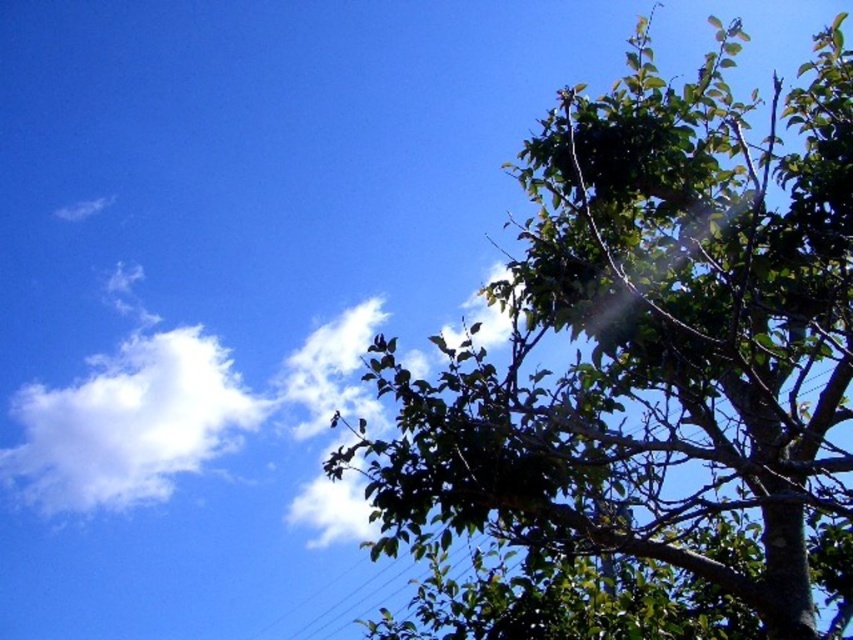
Is green leafy tree at upper right shorter than white fluffy cloud at upper left?

Incorrect, green leafy tree at upper right's height does not fall short of white fluffy cloud at upper left's.

The height and width of the screenshot is (640, 853). Identify the location of green leafy tree at upper right. (646, 378).

Does point (685, 332) come farther from viewer compared to point (361, 586)?

No, it is in front of (361, 586).

Is green leafy tree at upper right to the right of black wire at upper center from the viewer's perspective?

Yes, green leafy tree at upper right is to the right of black wire at upper center.

Image resolution: width=853 pixels, height=640 pixels. I want to click on green leafy tree at upper right, so click(x=646, y=378).

The width and height of the screenshot is (853, 640). Find the location of `green leafy tree at upper right`. green leafy tree at upper right is located at coordinates (646, 378).

Does white fluffy cloud at upper left appear on the left side of black wire at upper center?

Yes, white fluffy cloud at upper left is to the left of black wire at upper center.

Between white fluffy cloud at upper left and black wire at upper center, which one has less height?

With less height is black wire at upper center.

Describe the element at coordinates (128, 422) in the screenshot. I see `white fluffy cloud at upper left` at that location.

This screenshot has width=853, height=640. What are the coordinates of `white fluffy cloud at upper left` in the screenshot? It's located at (128, 422).